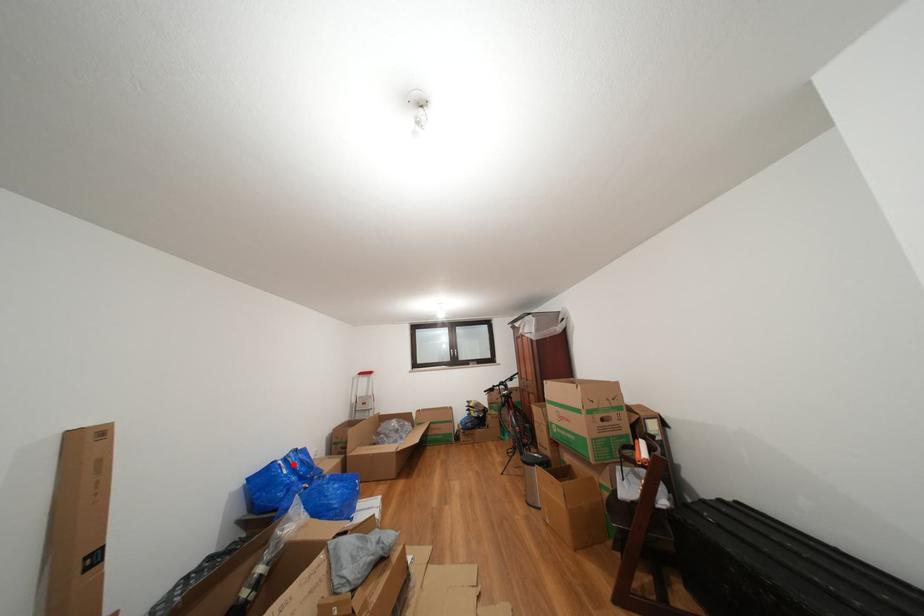
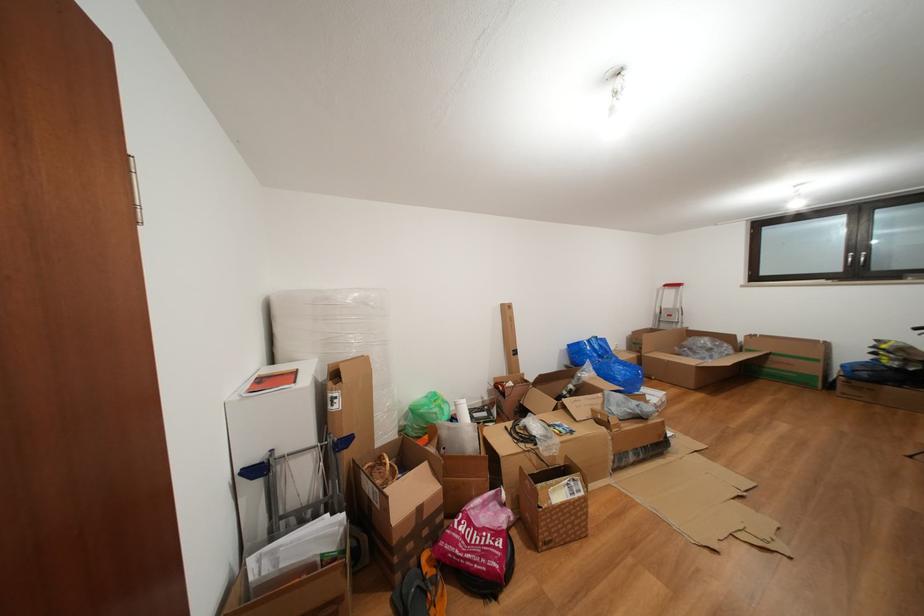
Question: I am providing you with two images of the same scene from different viewpoints. A red point is marked on the first image. Can you still see the location of the red point in image 2?

Choices:
 (A) Yes
 (B) No

Answer: (A)